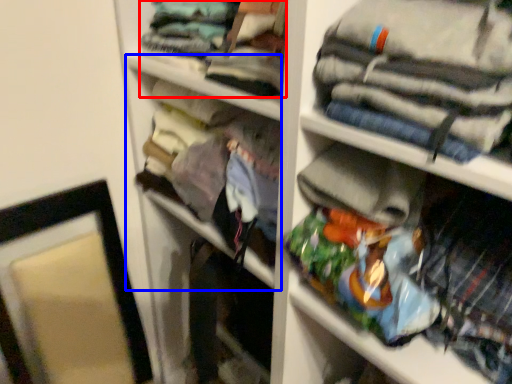
Question: Which point is further to the camera, clothing (highlighted by a red box) or cabinet (highlighted by a blue box)?

Choices:
 (A) clothing
 (B) cabinet

Answer: (B)